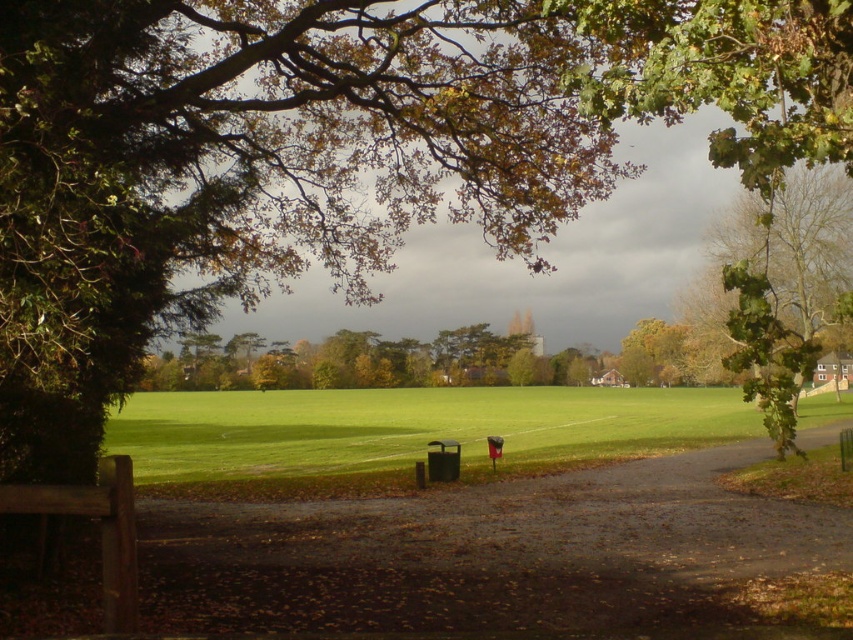
You are standing at the start of the dirt path in the park and see two points marked on the path. One is at point (25, 257) and the other at point (24, 508). Which point is closer to you as you begin walking along the path?

Point (25, 257) is closer to you because it is further to the viewer than point (24, 508), meaning it is nearer to your starting position.

You are a gardener planning to mow the green grassy field at center and trim the green leafy tree at upper right. Which area requires more horizontal space for your equipment to operate?

The green grassy field at center requires more horizontal space for equipment since its width surpasses that of the green leafy tree at upper right.

In the scene shown: You are planning to take a photo of the green leafy tree at upper center and the wooden bench at lower left from a position where both are visible. Considering their sizes, which object will appear bigger in your photo?

The green leafy tree at upper center will appear bigger in the photo because it is larger in size than the wooden bench at lower left.